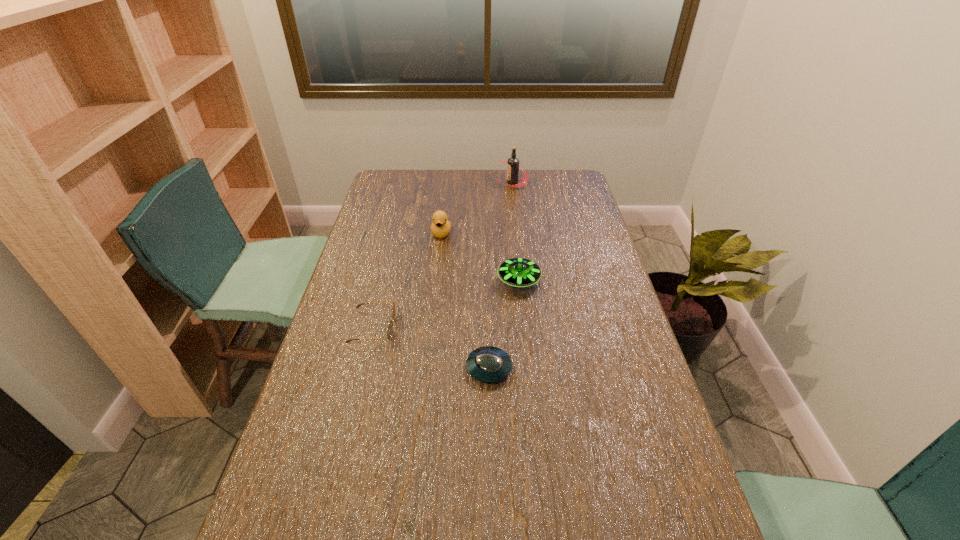
Where is `vacant space situated 0.190m on the label of the root beer`? vacant space situated 0.190m on the label of the root beer is located at coordinates (452, 182).

Where is `blank space located 0.330m on the label of the root beer`? The height and width of the screenshot is (540, 960). blank space located 0.330m on the label of the root beer is located at coordinates (420, 182).

What are the coordinates of `blank area located on the label of the root beer` in the screenshot? It's located at (475, 182).

Identify the location of vacant space located 0.170m on the face of the fourth nearest object. (437, 272).

You are a GUI agent. You are given a task and a screenshot of the screen. Output one action in this format:
    pyautogui.click(x=<x>, y=<y>)
    Task: Click on the vacant area located 0.080m on the back of the taller saucer
    This screenshot has width=960, height=540.
    Given the screenshot: What is the action you would take?
    pyautogui.click(x=516, y=252)

Find the location of a particular element. The image size is (960, 540). vacant space located 0.240m on the lenses of the fourth farthest object is located at coordinates (478, 328).

Find the location of a particular element. The height and width of the screenshot is (540, 960). vacant point located on the back of the nearest object is located at coordinates (488, 324).

Where is `object at the far edge`? This screenshot has height=540, width=960. object at the far edge is located at coordinates (513, 164).

Identify the location of object present at the left edge. This screenshot has width=960, height=540. (390, 325).

In the image, there is a desktop. Where is `blank space at the far edge`? The height and width of the screenshot is (540, 960). blank space at the far edge is located at coordinates (496, 191).